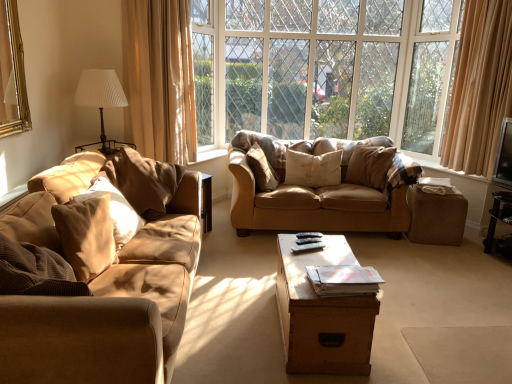
Question: Is plaid fabric at right thinner than wooden trunk at center?

Choices:
 (A) no
 (B) yes

Answer: (B)

Question: Could wooden trunk at center be considered to be inside plaid fabric at right?

Choices:
 (A) yes
 (B) no

Answer: (B)

Question: Is the depth of plaid fabric at right greater than that of wooden trunk at center?

Choices:
 (A) yes
 (B) no

Answer: (A)

Question: Can you confirm if plaid fabric at right is smaller than wooden trunk at center?

Choices:
 (A) yes
 (B) no

Answer: (A)

Question: Is there a large distance between plaid fabric at right and wooden trunk at center?

Choices:
 (A) no
 (B) yes

Answer: (B)

Question: Is plaid fabric at right to the left of wooden trunk at center from the viewer's perspective?

Choices:
 (A) yes
 (B) no

Answer: (B)

Question: Could you tell me if plush brown pillow at center, positioned as the 4th pillow in left-to-right order, is facing brown corduroy pillow at left, which ranks as the 4th pillow in right-to-left order?

Choices:
 (A) no
 (B) yes

Answer: (A)

Question: Is plush brown pillow at center, positioned as the third pillow in right-to-left order, not within brown corduroy pillow at left, which ranks as the 4th pillow in right-to-left order?

Choices:
 (A) no
 (B) yes

Answer: (B)

Question: Is plush brown pillow at center, positioned as the third pillow in right-to-left order, at the left side of brown corduroy pillow at left, which ranks as the 4th pillow in right-to-left order?

Choices:
 (A) yes
 (B) no

Answer: (B)

Question: Is brown corduroy pillow at left, which ranks as the 4th pillow in right-to-left order, a part of plush brown pillow at center, positioned as the third pillow in right-to-left order?

Choices:
 (A) yes
 (B) no

Answer: (B)

Question: From the image's perspective, is plush brown pillow at center, positioned as the third pillow in right-to-left order, located beneath brown corduroy pillow at left, which ranks as the 4th pillow in right-to-left order?

Choices:
 (A) yes
 (B) no

Answer: (B)

Question: Is plush brown pillow at center, positioned as the third pillow in right-to-left order, thinner than brown corduroy pillow at left, which ranks as the 4th pillow in right-to-left order?

Choices:
 (A) no
 (B) yes

Answer: (B)

Question: Is clear glass window at center inside metallic silver tv at right?

Choices:
 (A) yes
 (B) no

Answer: (B)